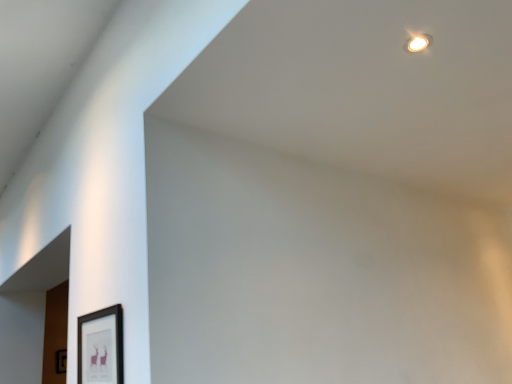
What do you see at coordinates (101, 346) in the screenshot? This screenshot has width=512, height=384. I see `black matte picture frame at lower left` at bounding box center [101, 346].

Locate an element on the screen. black matte picture frame at lower left is located at coordinates (101, 346).

The width and height of the screenshot is (512, 384). Find the location of `black matte picture frame at lower left`. black matte picture frame at lower left is located at coordinates (101, 346).